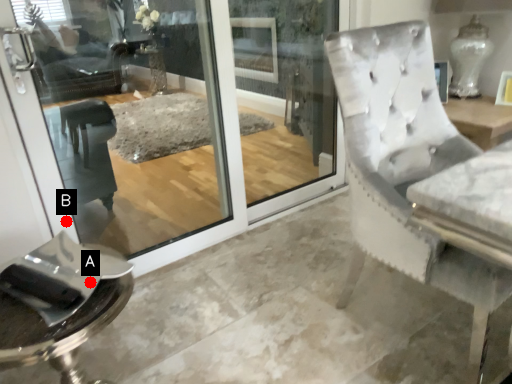
Question: Two points are circled on the image, labeled by A and B beside each circle. Which point appears farthest from the camera in this image?

Choices:
 (A) A is further
 (B) B is further

Answer: (B)